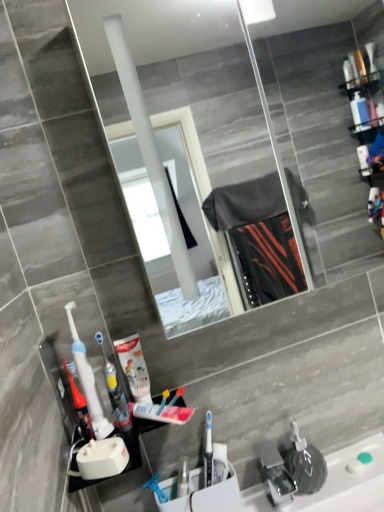
Question: Based on their positions, is translucent plastic toothbrush at left, placed as the 2th toothbrush when sorted from right to left, located to the left or right of white plastic toothbrush at center, which appears as the 2th toothbrush when viewed from the left?

Choices:
 (A) left
 (B) right

Answer: (A)

Question: Is translucent plastic toothbrush at left, placed as the 2th toothbrush when sorted from right to left, situated inside white plastic toothbrush at center, which appears as the 2th toothbrush when viewed from the left, or outside?

Choices:
 (A) inside
 (B) outside

Answer: (B)

Question: Which object is the closest to the clear plastic sink at lower right, marked as the 2th sink in a left-to-right arrangement?

Choices:
 (A) white plastic toothbrush at center, arranged as the 1th toothbrush when viewed from the right
 (B) white plastic toothbrush holder at lower center, the first sink from the left
 (C) translucent plastic toothbrush at left, the 1th toothbrush in the left-to-right sequence
 (D) white glossy toothpaste tube at center
 (E) translucent plastic mouthwash at lower left

Answer: (B)

Question: Considering the real-world distances, which object is closest to the white plastic toothbrush holder at lower center, the first sink from the left?

Choices:
 (A) white glossy toothpaste tube at center
 (B) translucent plastic toothbrush at left, placed as the 2th toothbrush when sorted from right to left
 (C) translucent plastic mouthwash at lower left
 (D) clear plastic sink at lower right, arranged as the first sink when viewed from the right
 (E) white plastic toothbrush at center, which appears as the 2th toothbrush when viewed from the left

Answer: (D)